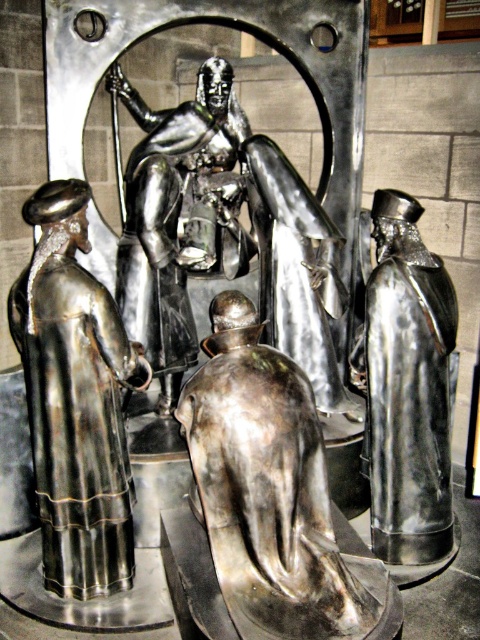
You are an art curator planning to display the polished silver knight at center and the shiny silver figure at right in a new exhibition. Given their sizes, which one should be placed in the central display area to maintain the sculpture theme?

The polished silver knight at center should be placed in the central display area because its width is larger than the shiny silver figure at right, aligning with its prominent position in the sculpture theme.

You are an art conservator examining the metallic sculpture. You notice two points on the sculpture labeled as point (254, 403) and point (432, 496). Which of these points is nearer to your current viewpoint?

Point (254, 403) is closer to the camera than point (432, 496), so the point (254, 403) is nearer to your viewpoint.

You are an art conservator assessing the sculpture. You need to determine if the shiny silver figure at center can be moved to the position of the shiny silver figure at right without altering the base. Based on their widths, is this feasible?

The shiny silver figure at center might be wider than shiny silver figure at right, so moving it might not be feasible as it could exceed the space allocated for the shiny silver figure at right.